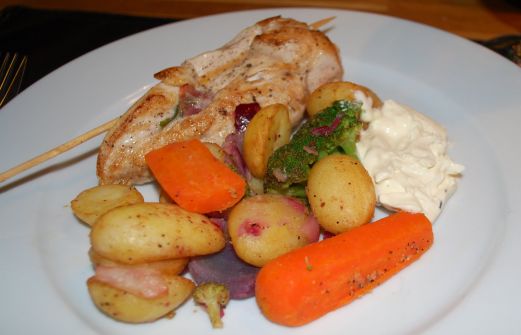
This screenshot has height=335, width=521. What are the coordinates of `place mat` in the screenshot? It's located at (46, 42).